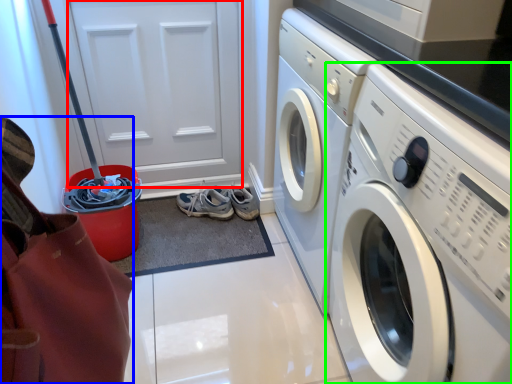
Question: Estimate the real-world distances between objects in this image. Which object is closer to door (highlighted by a red box), material (highlighted by a blue box) or washing machine (highlighted by a green box)?

Choices:
 (A) material
 (B) washing machine

Answer: (B)